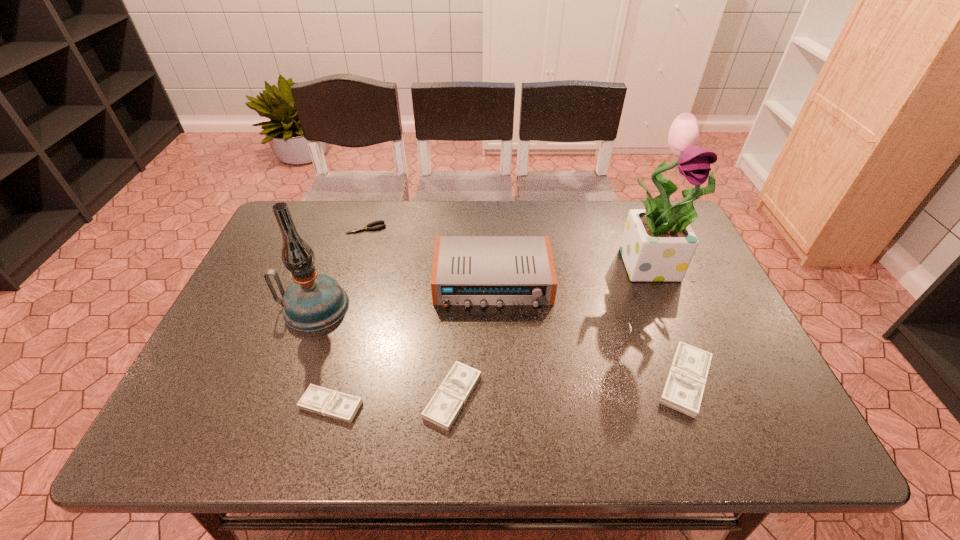
Find the location of a particular element. vacant space located 0.050m on the back of the leftmost money is located at coordinates (341, 369).

Identify the location of vacant space positioned on the back of the second shortest money. (456, 339).

I want to click on blank space located 0.320m on the back of the rightmost money, so click(638, 259).

The width and height of the screenshot is (960, 540). What are the coordinates of `free region located on the right of the farthest object` in the screenshot? It's located at (436, 228).

Identify the location of free space located on the front panel of the third tallest object. (496, 390).

Identify the location of vacant space positioned 0.070m on the front-facing side of the tallest object. Image resolution: width=960 pixels, height=540 pixels. [674, 310].

Where is `free region located 0.080m on the right of the second tallest object`? The image size is (960, 540). free region located 0.080m on the right of the second tallest object is located at coordinates (379, 307).

I want to click on pliers situated at the far edge, so click(x=367, y=227).

You are a GUI agent. You are given a task and a screenshot of the screen. Output one action in this format:
    pyautogui.click(x=<x>, y=<y>)
    Task: Click on the flower arrangement that is at the far edge
    The width and height of the screenshot is (960, 540).
    Given the screenshot: What is the action you would take?
    pyautogui.click(x=658, y=244)

Find the location of a particular element. The width and height of the screenshot is (960, 540). object that is at the left edge is located at coordinates (313, 302).